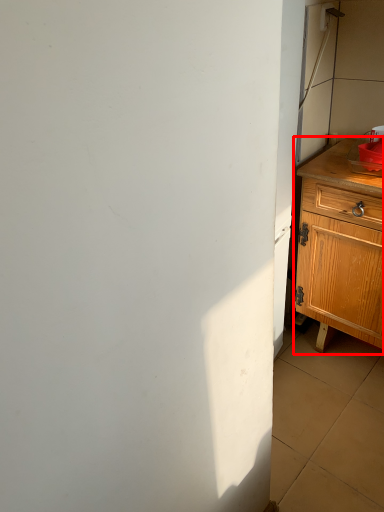
Question: From the image, what is the correct spatial relationship of chest of drawers (annotated by the red box) in relation to sink?

Choices:
 (A) right
 (B) left

Answer: (A)